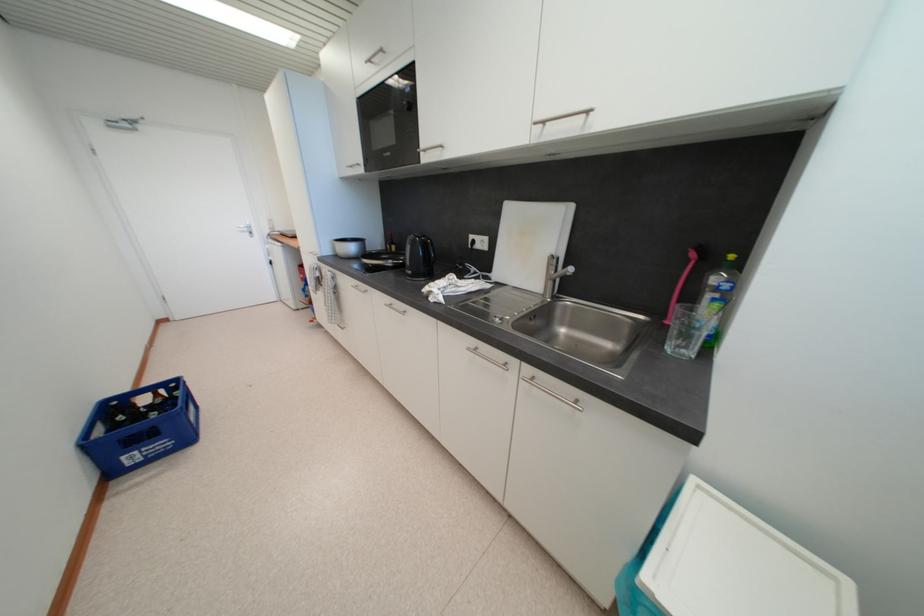
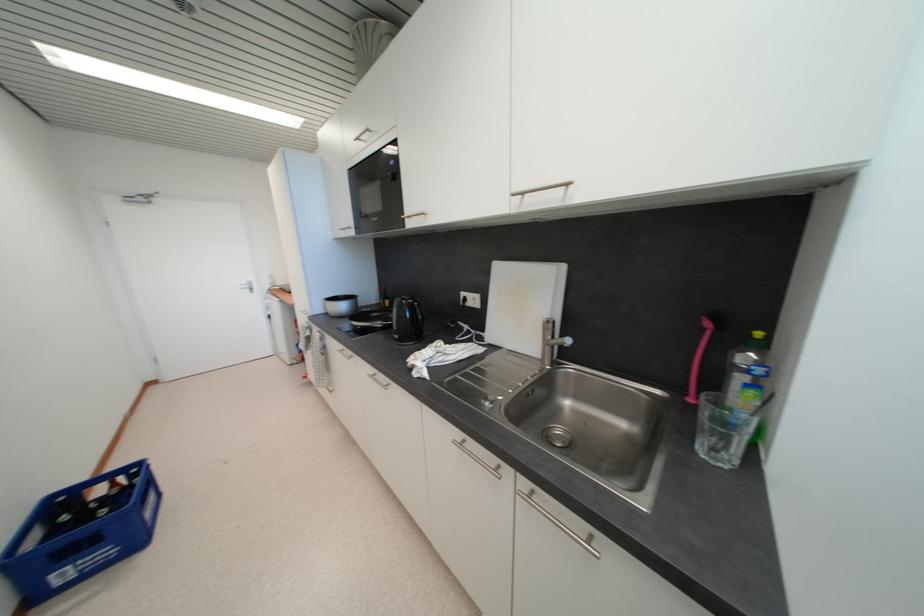
Locate, in the second image, the point that corresponds to the point at 723,307 in the first image.

(757, 394)